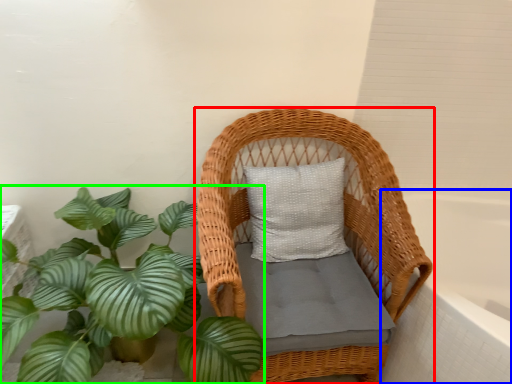
Question: Based on their relative distances, which object is farther from furniture (highlighted by a red box)? Choose from bath (highlighted by a blue box) and houseplant (highlighted by a green box).

Choices:
 (A) bath
 (B) houseplant

Answer: (A)